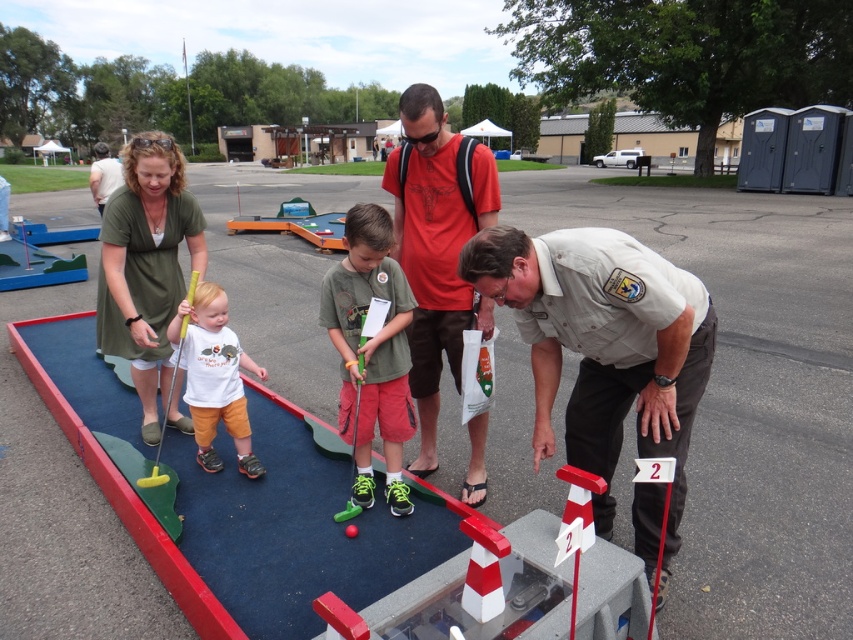
You are playing mini golf and want to place your ball at the point marked as point [566,324]. According to the scene description, what object is located at that coordinate?

The point [566,324] corresponds to the matte green dress at upper left.

You are a photographer positioned at the edge of the mini golf course. You want to take a photo that includes both the khaki uniform at center and the white cotton shirt at center. Which one should you adjust your camera angle to focus on first to ensure both are in frame?

A: The khaki uniform at center is in front of the white cotton shirt at center, so you should focus on the khaki uniform at center first to ensure both are visible in the photo.

You are playing mini golf and want to hit the ball over the smooth plastic barrier at center. What is the exact coordinate point where the barrier is located?

The smooth plastic barrier at center is located at point (292, 524).